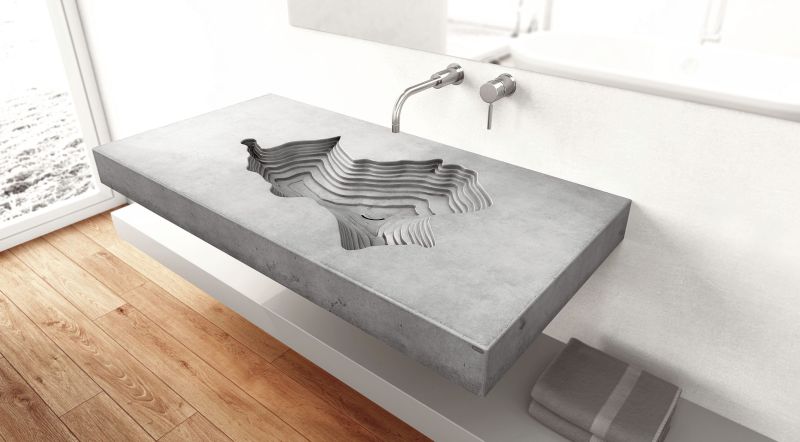
This screenshot has width=800, height=442. I want to click on glass door, so click(36, 134).